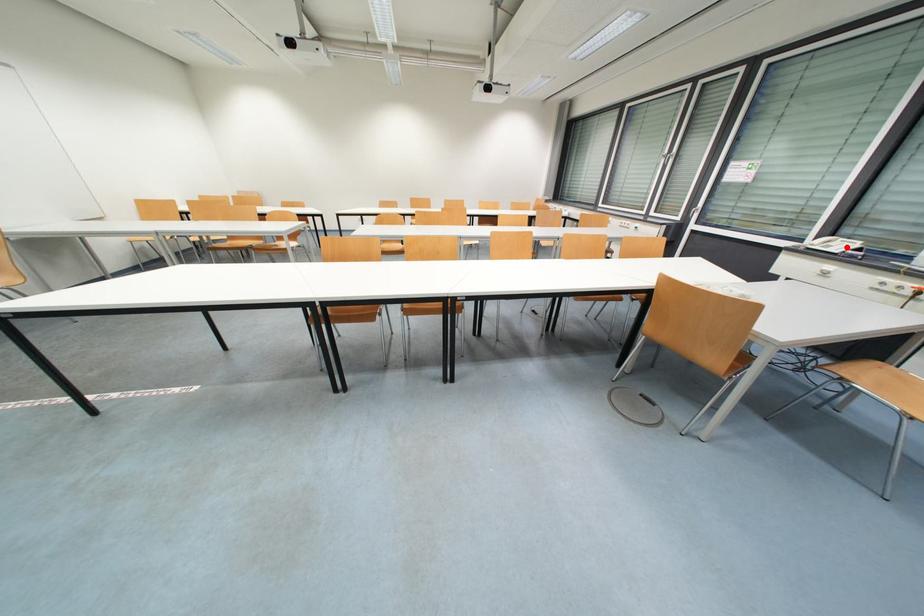
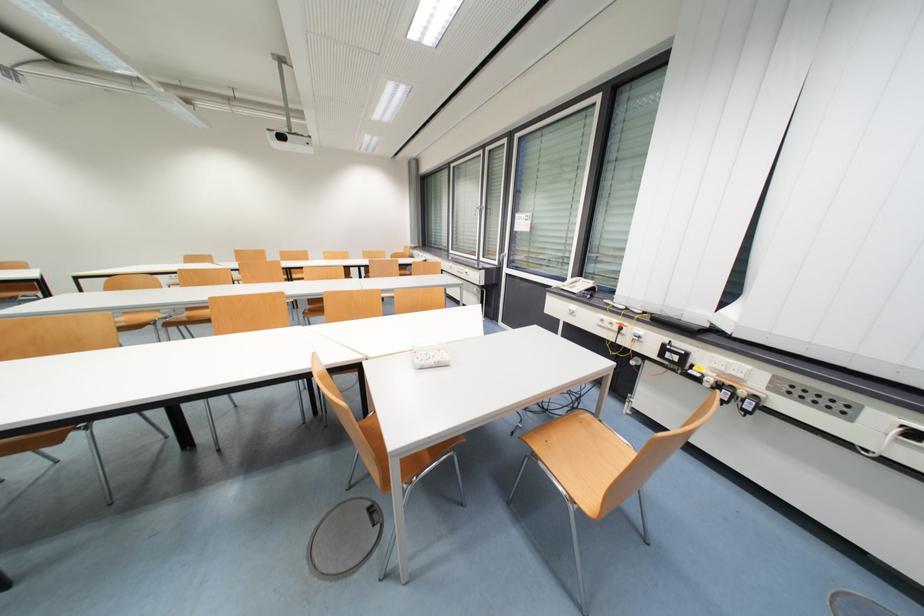
Question: I am providing you with two images of the same scene from different viewpoints. Given a red point in image1, look at the same physical point in image2. Is it:

Choices:
 (A) Closer to the viewpoint
 (B) Farther from the viewpoint

Answer: (A)